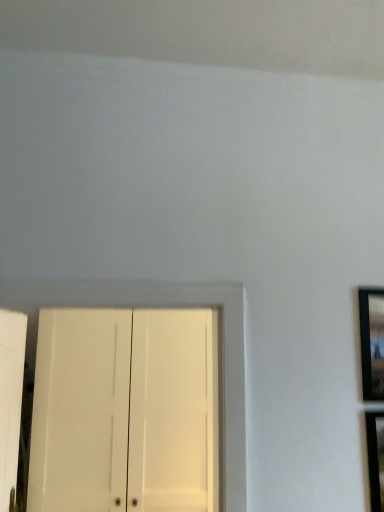
Question: Is white matte cabinet at lower left at the left side of black glossy picture frame at right?

Choices:
 (A) no
 (B) yes

Answer: (B)

Question: Is white matte cabinet at lower left facing towards black glossy picture frame at right?

Choices:
 (A) no
 (B) yes

Answer: (A)

Question: Is white matte cabinet at lower left to the right of black glossy picture frame at right from the viewer's perspective?

Choices:
 (A) yes
 (B) no

Answer: (B)

Question: Is white matte cabinet at lower left beside black glossy picture frame at right?

Choices:
 (A) yes
 (B) no

Answer: (B)

Question: Is white matte cabinet at lower left behind black glossy picture frame at right?

Choices:
 (A) yes
 (B) no

Answer: (A)

Question: From the image's perspective, is white matte cabinet at lower left located above black glossy picture frame at right?

Choices:
 (A) yes
 (B) no

Answer: (B)

Question: Does black glossy picture frame at right appear on the left side of white matte cabinet at lower left?

Choices:
 (A) yes
 (B) no

Answer: (B)

Question: Is black glossy picture frame at right outside of white matte cabinet at lower left?

Choices:
 (A) no
 (B) yes

Answer: (B)

Question: From a real-world perspective, is black glossy picture frame at right positioned over white matte cabinet at lower left based on gravity?

Choices:
 (A) yes
 (B) no

Answer: (A)

Question: Is black glossy picture frame at right touching white matte cabinet at lower left?

Choices:
 (A) no
 (B) yes

Answer: (A)

Question: Is white matte cabinet at lower left completely or partially inside black glossy picture frame at right?

Choices:
 (A) yes
 (B) no

Answer: (B)

Question: Is black glossy picture frame at right turned away from white matte cabinet at lower left?

Choices:
 (A) yes
 (B) no

Answer: (B)

Question: Is black glossy picture frame at right taller or shorter than white matte cabinet at lower left?

Choices:
 (A) tall
 (B) short

Answer: (B)